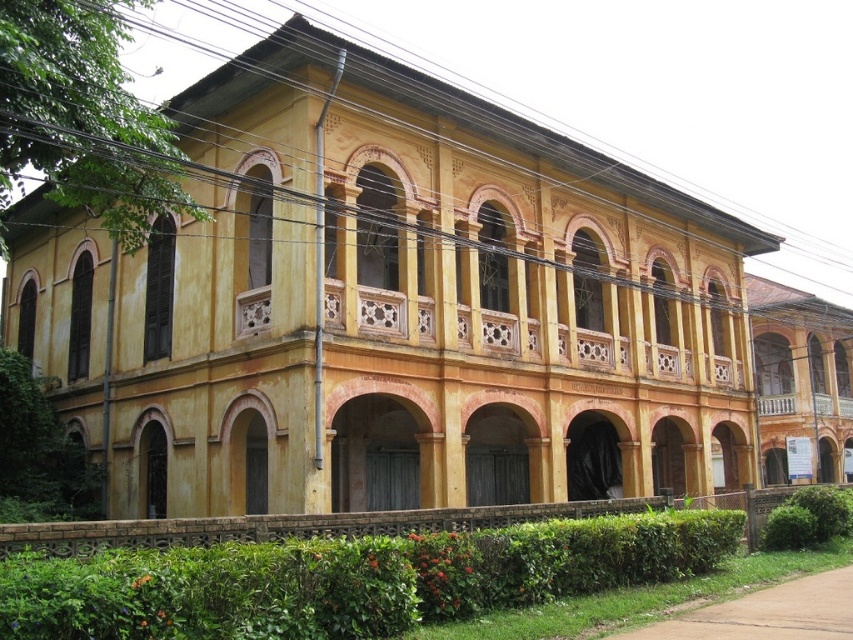
Where is `green leafy hedge at lower center`? green leafy hedge at lower center is located at coordinates (351, 579).

Is green leafy hedge at lower center smaller than yellow painted wood at right?

Yes, green leafy hedge at lower center is smaller than yellow painted wood at right.

The image size is (853, 640). Describe the element at coordinates (351, 579) in the screenshot. I see `green leafy hedge at lower center` at that location.

Locate an element on the screen. green leafy hedge at lower center is located at coordinates click(351, 579).

Between point (762, 444) and point (815, 532), which one is positioned in front?

Point (815, 532)

Does yellow painted wood at right appear on the left side of green leafy hedge at lower right?

No, yellow painted wood at right is not to the left of green leafy hedge at lower right.

Is point (786, 308) positioned in front of point (846, 509)?

That is False.

Where is `yellow painted wood at right`? This screenshot has width=853, height=640. yellow painted wood at right is located at coordinates (799, 378).

This screenshot has width=853, height=640. Identify the location of green leafy hedge at lower center. (351, 579).

Can you confirm if green leafy hedge at lower center is wider than green leafy hedge at lower right?

Yes.

Is point (105, 550) in front of point (822, 525)?

That is True.

Image resolution: width=853 pixels, height=640 pixels. I want to click on green leafy hedge at lower center, so click(351, 579).